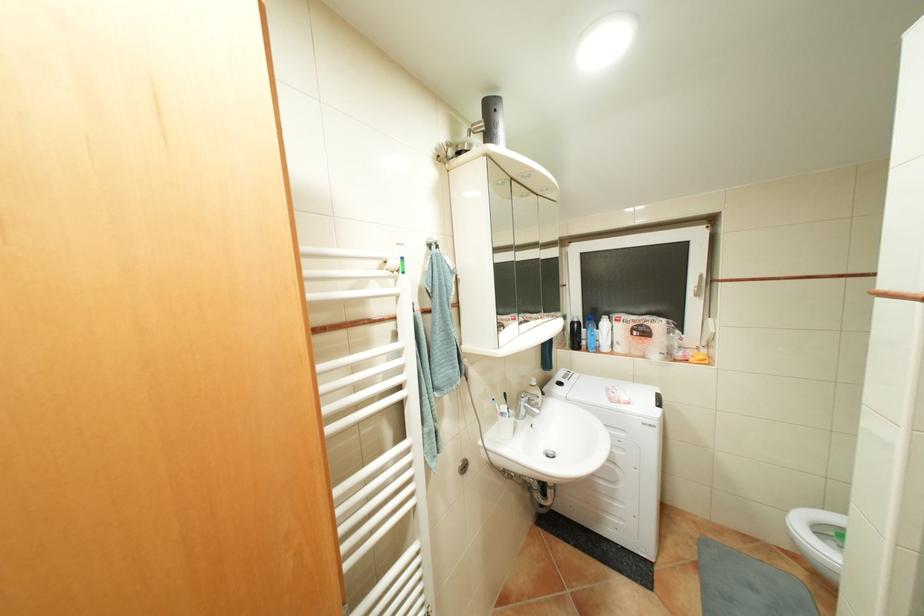
Find the location of a particular element. soap dispenser pump is located at coordinates (532, 400).